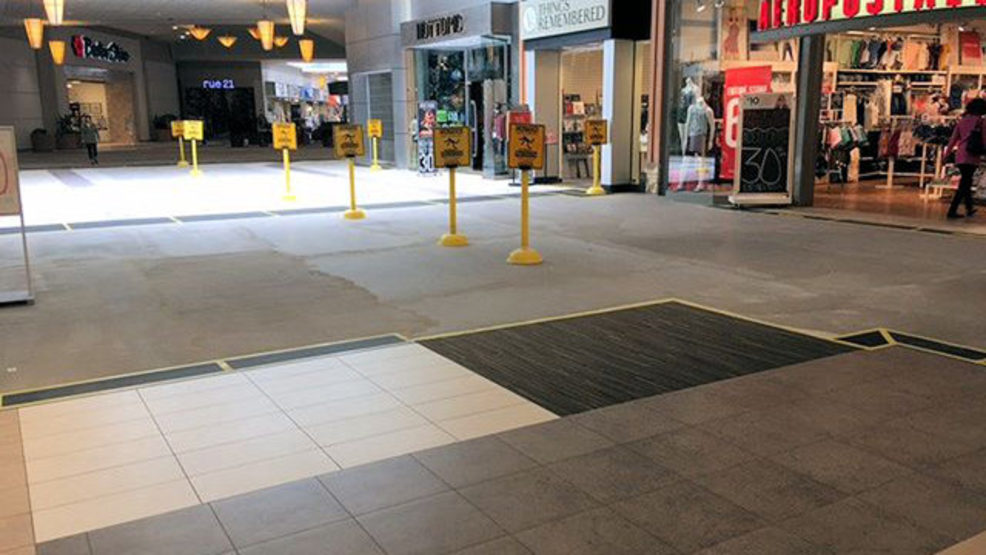
At what (x,y) coordinates should I click in order to perform the action: click on sunlit floor area. Please return your answer as a coordinate pair (x, y). Looking at the image, I should click on (39, 208), (142, 196), (250, 188), (331, 184), (396, 186).